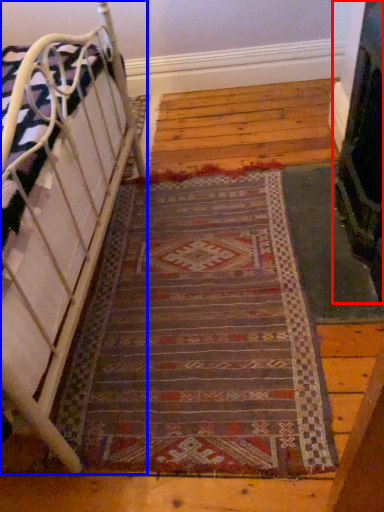
Question: Which object appears farthest to the camera in this image, fireplace (highlighted by a red box) or furniture (highlighted by a blue box)?

Choices:
 (A) fireplace
 (B) furniture

Answer: (A)